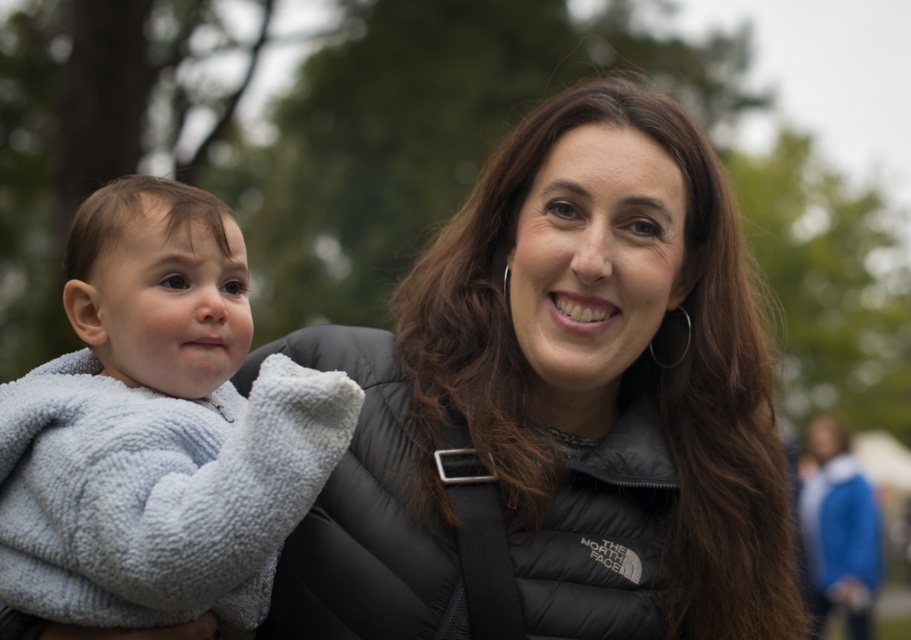
You are standing in the park and see the black puffer jacket at center. If you want to find the exact location of the jacket, what coordinates would you use?

The exact coordinates of the black puffer jacket at center are at point (561, 401).

You are standing in a park and see the image. The black puffer jacket at center is located at point (561, 401). If you want to find the exact location of the black puffer jacket at center, what coordinates should you look for?

The coordinates for the black puffer jacket at center are (561, 401).

You are a photographer setting up a shot for a clothing catalog. You have two items to feature in the frame simultaneously. The black puffer jacket at center and the soft gray fleece at left. Given their sizes, which item should you position closer to the camera to maintain visual balance?

The black puffer jacket at center is larger in width than the soft gray fleece at left, so positioning the smaller soft gray fleece at left closer to the camera will help balance the composition.